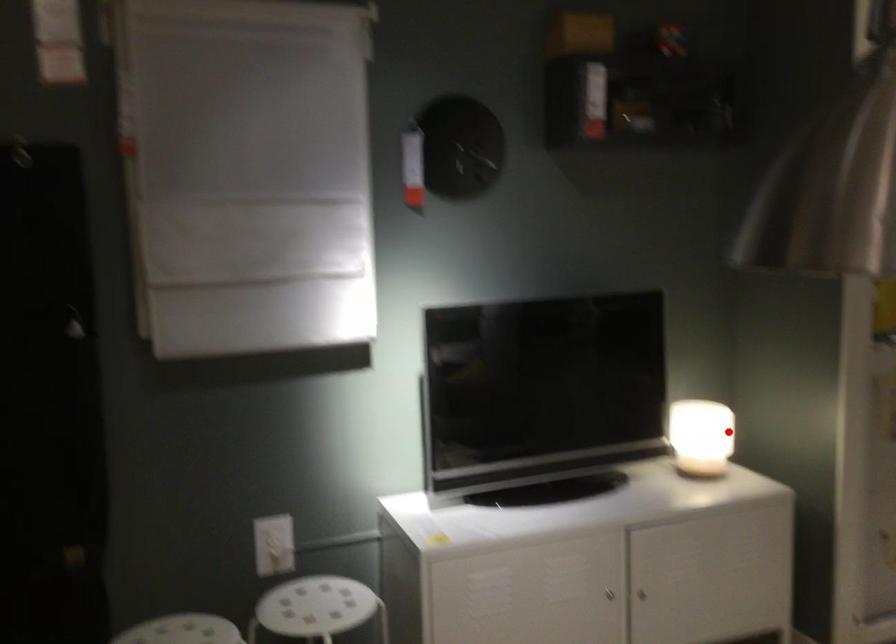
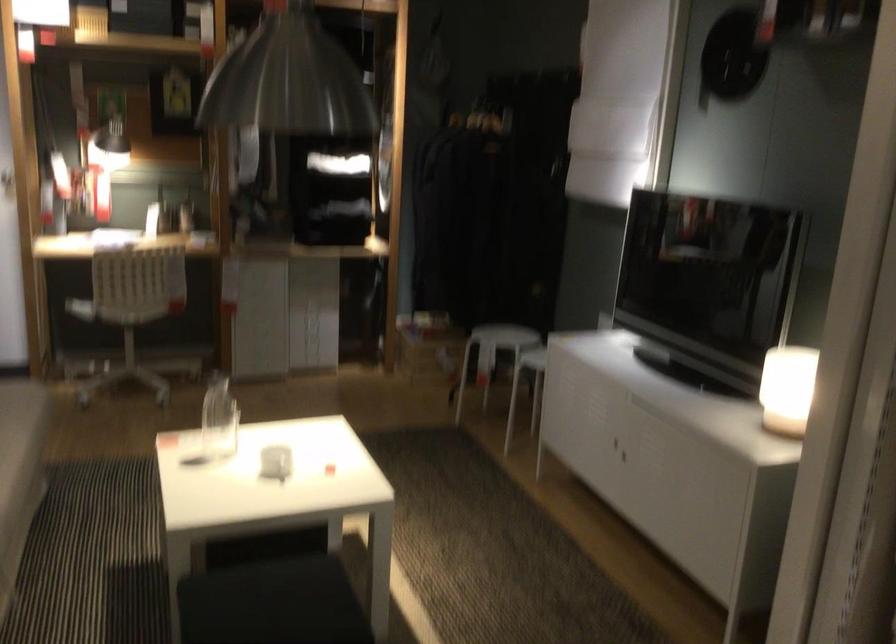
Question: I am providing you with two images of the same scene from different viewpoints. In image1, a red point is highlighted. Considering the same 3D point in image2, which of the following is correct?

Choices:
 (A) It is closer
 (B) It is farther

Answer: (A)